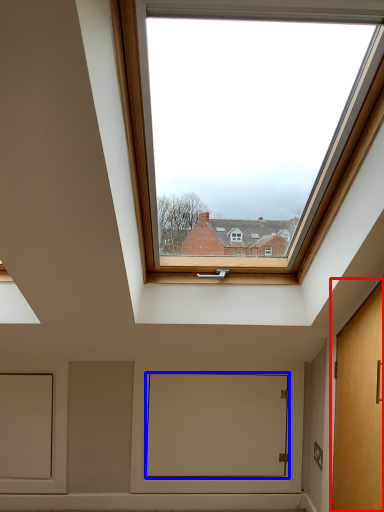
Question: Which of the following is the closest to the observer, door (highlighted by a red box) or window screen (highlighted by a blue box)?

Choices:
 (A) door
 (B) window screen

Answer: (A)